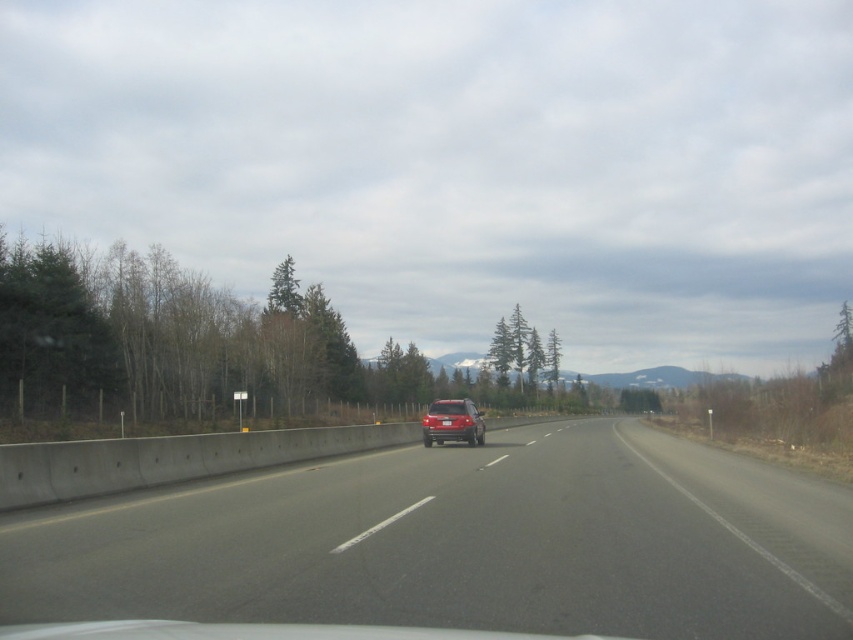
Question: Which object is farther from the camera taking this photo?

Choices:
 (A) satin red suv at center
 (B) smooth asphalt road at center

Answer: (A)

Question: In this image, where is smooth asphalt road at center located relative to satin red suv at center?

Choices:
 (A) right
 (B) left

Answer: (A)

Question: Does smooth asphalt road at center appear under satin red suv at center?

Choices:
 (A) yes
 (B) no

Answer: (B)

Question: Observing the image, what is the correct spatial positioning of smooth asphalt road at center in reference to satin red suv at center?

Choices:
 (A) below
 (B) above

Answer: (B)